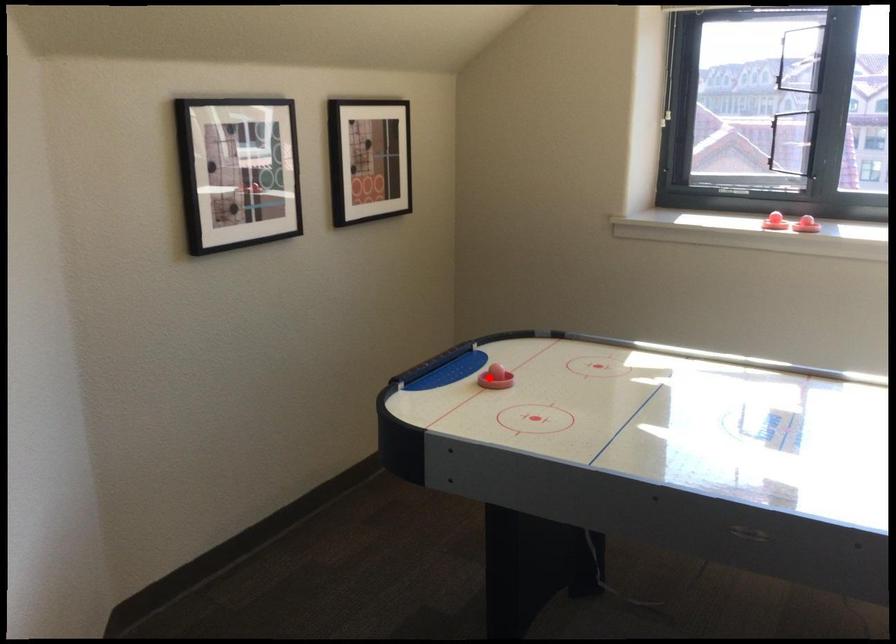
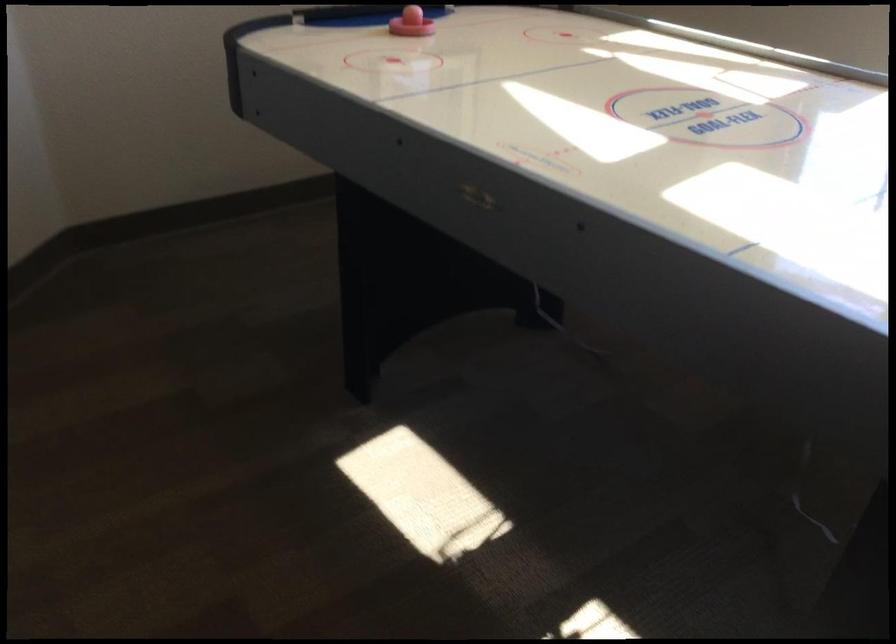
Locate, in the second image, the point that corresponds to the highlighted location in the first image.

(410, 23)